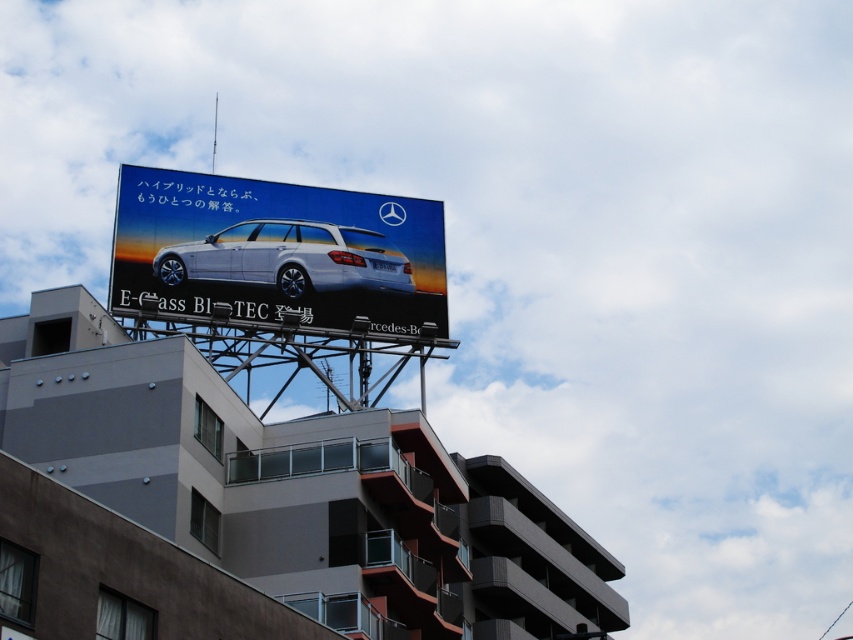
Is white glossy car at upper center thinner than white glossy wagon at center?

Incorrect, white glossy car at upper center's width is not less than white glossy wagon at center's.

Between point (221, 209) and point (196, 257), which one is positioned behind?

Point (221, 209)

Between point (184, 177) and point (316, 228), which one is positioned behind?

The point (316, 228) is behind.

What are the coordinates of `white glossy car at upper center` in the screenshot? It's located at (277, 252).